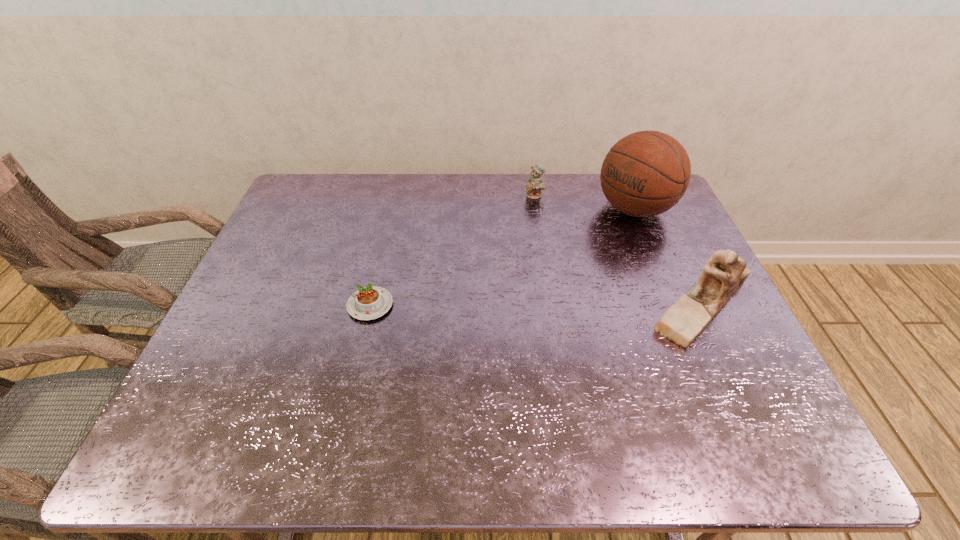
Image resolution: width=960 pixels, height=540 pixels. I want to click on vacant region located 0.280m on the side with brand label of the basketball, so click(x=549, y=266).

You are a GUI agent. You are given a task and a screenshot of the screen. Output one action in this format:
    pyautogui.click(x=<x>, y=<y>)
    Task: Click on the blank space located 0.100m on the side with brand label of the basketball
    
    Given the screenshot: What is the action you would take?
    pyautogui.click(x=589, y=239)

In order to click on free space located on the side with brand label of the basketball in this screenshot , I will do `click(549, 266)`.

Where is `vacant space located on the front-facing side of the second object from left to right`? The image size is (960, 540). vacant space located on the front-facing side of the second object from left to right is located at coordinates (516, 276).

This screenshot has width=960, height=540. Find the location of `free space located 0.260m on the front-facing side of the second object from left to right`. free space located 0.260m on the front-facing side of the second object from left to right is located at coordinates (521, 250).

Find the location of a particular element. The image size is (960, 540). vacant space positioned on the front-facing side of the second object from left to right is located at coordinates 527,227.

Where is `basketball that is at the far edge`? This screenshot has height=540, width=960. basketball that is at the far edge is located at coordinates (646, 173).

Find the location of a particular element. This screenshot has height=540, width=960. teddy bear positioned at the far edge is located at coordinates (535, 183).

This screenshot has width=960, height=540. Identify the location of figurine located at the right edge. (725, 272).

This screenshot has width=960, height=540. Find the location of `basketball that is at the right edge`. basketball that is at the right edge is located at coordinates (646, 173).